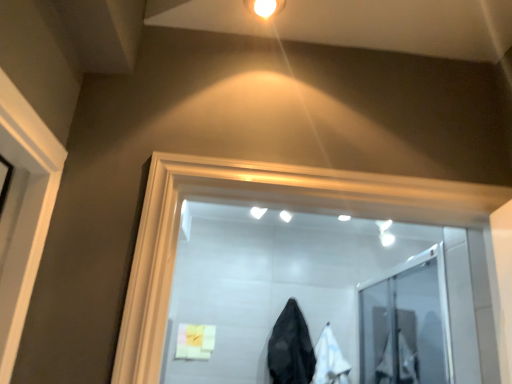
Question: From a real-world perspective, is transparent glass door at center positioned above or below soft yellow cloth at lower center?

Choices:
 (A) above
 (B) below

Answer: (A)

Question: Is transparent glass door at center in front of or behind soft yellow cloth at lower center in the image?

Choices:
 (A) front
 (B) behind

Answer: (A)

Question: Estimate the real-world distances between objects in this image. Which object is farther from the soft yellow cloth at lower center?

Choices:
 (A) black matte coat at center, the first garment positioned from the left
 (B) transparent glass door at center
 (C) white fabric at center, which is the 2th garment in left-to-right order

Answer: (B)

Question: Based on their relative distances, which object is farther from the white fabric at center, which is the 2th garment in left-to-right order?

Choices:
 (A) black matte coat at center, the 2th garment viewed from the right
 (B) transparent glass door at center
 (C) soft yellow cloth at lower center

Answer: (C)